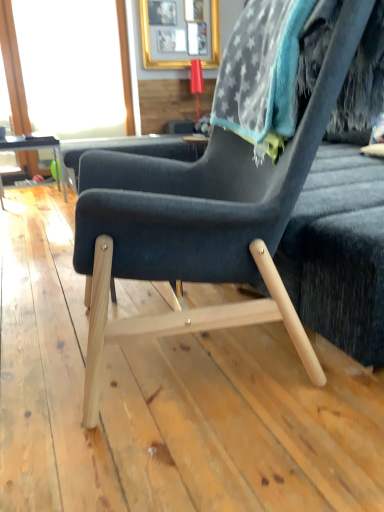
Question: Is dark blue fabric chair at center inside or outside of transparent glass window screen at upper left?

Choices:
 (A) inside
 (B) outside

Answer: (B)

Question: From the image's perspective, is dark blue fabric chair at center above or below transparent glass window screen at upper left?

Choices:
 (A) above
 (B) below

Answer: (B)

Question: Which object is the farthest from the matte black table at left?

Choices:
 (A) transparent glass window screen at upper left
 (B) dark blue fabric chair at center
 (C) gray fuzzy bean bag at upper right
 (D) gold metallic picture frame at upper center

Answer: (C)

Question: Based on their relative distances, which object is nearer to the matte black table at left?

Choices:
 (A) transparent glass window screen at upper left
 (B) gold metallic picture frame at upper center
 (C) dark blue fabric chair at center
 (D) gray fuzzy bean bag at upper right

Answer: (A)